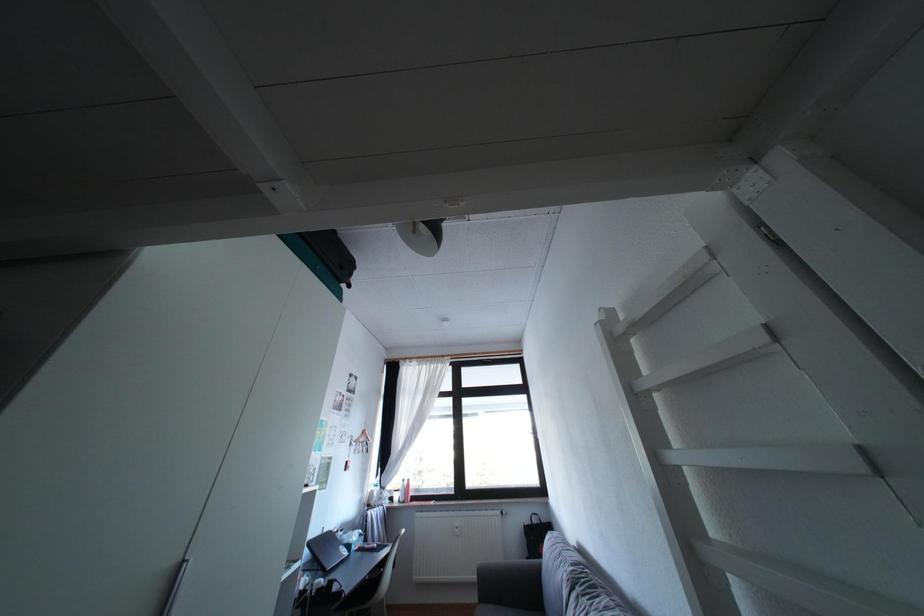
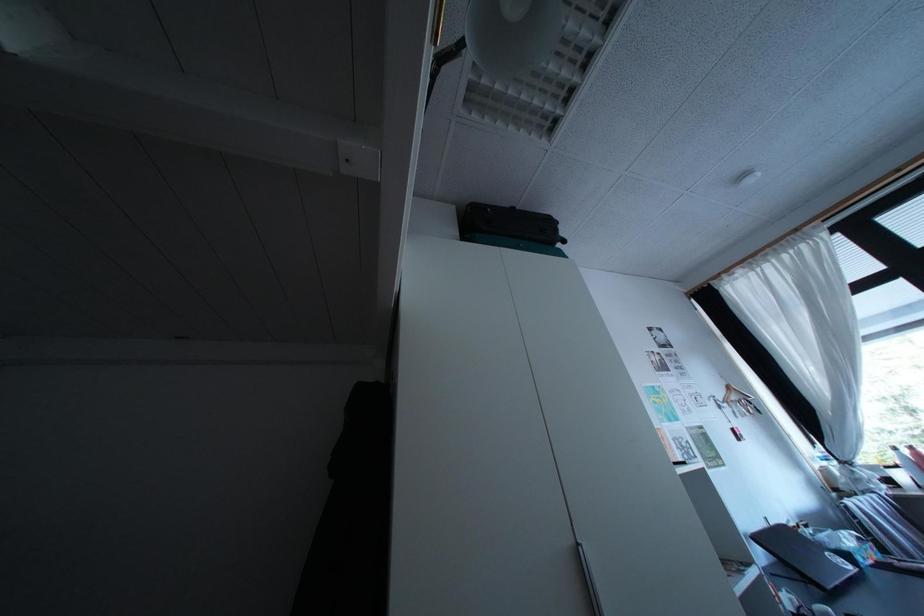
Question: Based on the continuous images, in which direction is the camera rotating? Reply with the corresponding letter.

Choices:
 (A) Left
 (B) Right
 (C) Up
 (D) Down

Answer: (A)